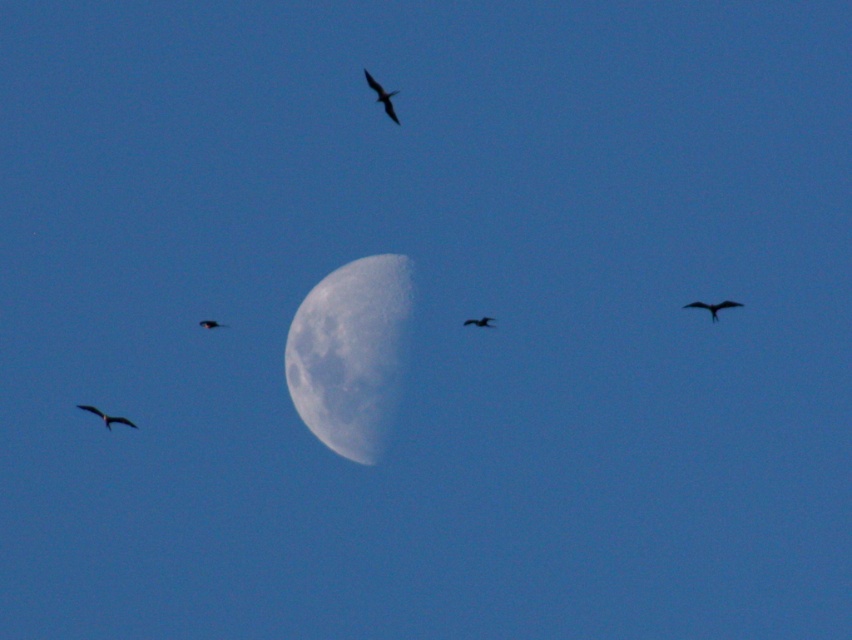
You are an astronomer observing the night sky and want to determine which of the two points, point (285, 369) or point (78, 404), is closer to the moon. Based on their positions, which point is nearer?

Point (285, 369) is further to the viewer than point (78, 404). Therefore, point (78, 404) is closer to the moon.